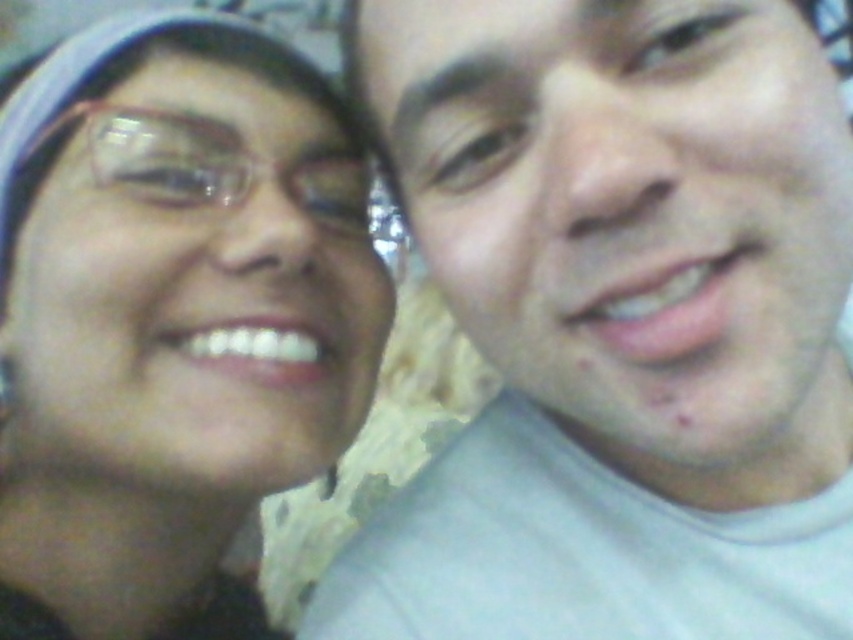
You are a photographer standing in front of the matte gray shirt at right. You want to take a clear photo of it. What is the minimum distance you should maintain to ensure the camera can focus properly?

The minimum distance you should maintain is 12.91 inches from the matte gray shirt at right to ensure proper focus.

You are taking a photo of two people standing in front of you. You notice two points in the image at coordinates point (682, 344) and point (264, 397). Which point is closer to you?

Point (682, 344) is closer to the viewer than point (264, 397).